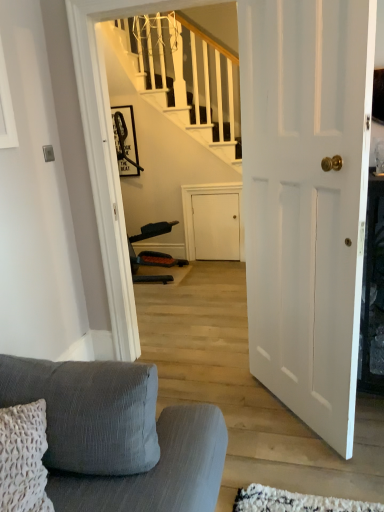
Question: Does matte black picture frame at upper center have a lesser width compared to white matte door at center?

Choices:
 (A) yes
 (B) no

Answer: (A)

Question: Is matte black picture frame at upper center to the left of white matte door at center from the viewer's perspective?

Choices:
 (A) yes
 (B) no

Answer: (A)

Question: Does matte black picture frame at upper center appear on the right side of white matte door at center?

Choices:
 (A) yes
 (B) no

Answer: (B)

Question: Is matte black picture frame at upper center smaller than white matte door at center?

Choices:
 (A) yes
 (B) no

Answer: (A)

Question: Is matte black picture frame at upper center turned away from white matte door at center?

Choices:
 (A) no
 (B) yes

Answer: (A)

Question: From a real-world perspective, is matte black picture frame at upper center located higher than white matte door at center?

Choices:
 (A) yes
 (B) no

Answer: (A)

Question: Considering the relative positions of textured gray fabric couch at lower left and matte black picture frame at upper center in the image provided, is textured gray fabric couch at lower left to the right of matte black picture frame at upper center from the viewer's perspective?

Choices:
 (A) no
 (B) yes

Answer: (B)

Question: Does textured gray fabric couch at lower left turn towards matte black picture frame at upper center?

Choices:
 (A) no
 (B) yes

Answer: (A)

Question: Is textured gray fabric couch at lower left far from matte black picture frame at upper center?

Choices:
 (A) no
 (B) yes

Answer: (B)

Question: From a real-world perspective, is textured gray fabric couch at lower left over matte black picture frame at upper center?

Choices:
 (A) no
 (B) yes

Answer: (A)

Question: Is matte black picture frame at upper center at the back of textured gray fabric couch at lower left?

Choices:
 (A) no
 (B) yes

Answer: (A)

Question: Is textured gray fabric couch at lower left wider than matte black picture frame at upper center?

Choices:
 (A) yes
 (B) no

Answer: (A)

Question: Is white matte door at center in front of textured gray fabric couch at lower left?

Choices:
 (A) yes
 (B) no

Answer: (B)